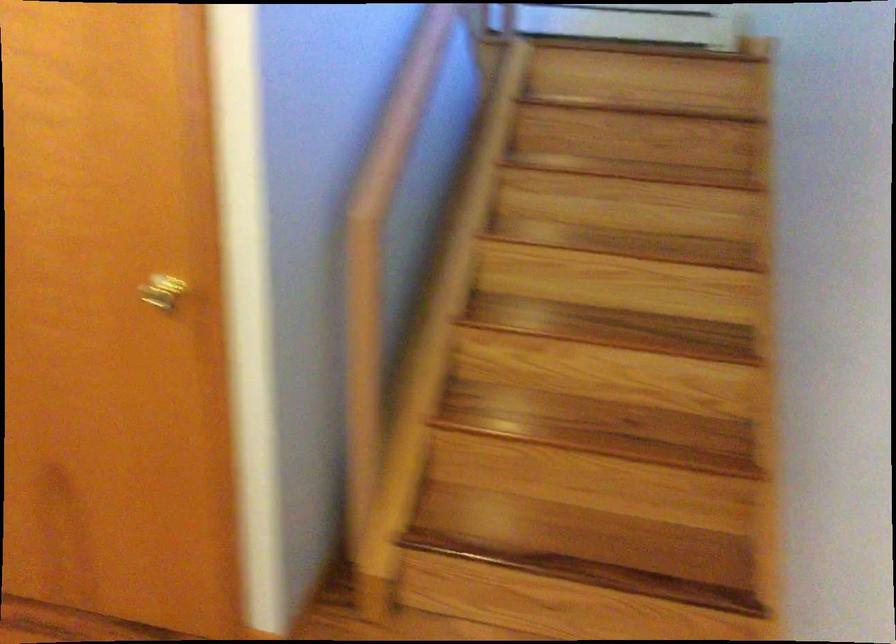
The height and width of the screenshot is (644, 896). Describe the element at coordinates (380, 256) in the screenshot. I see `the wooden handrail` at that location.